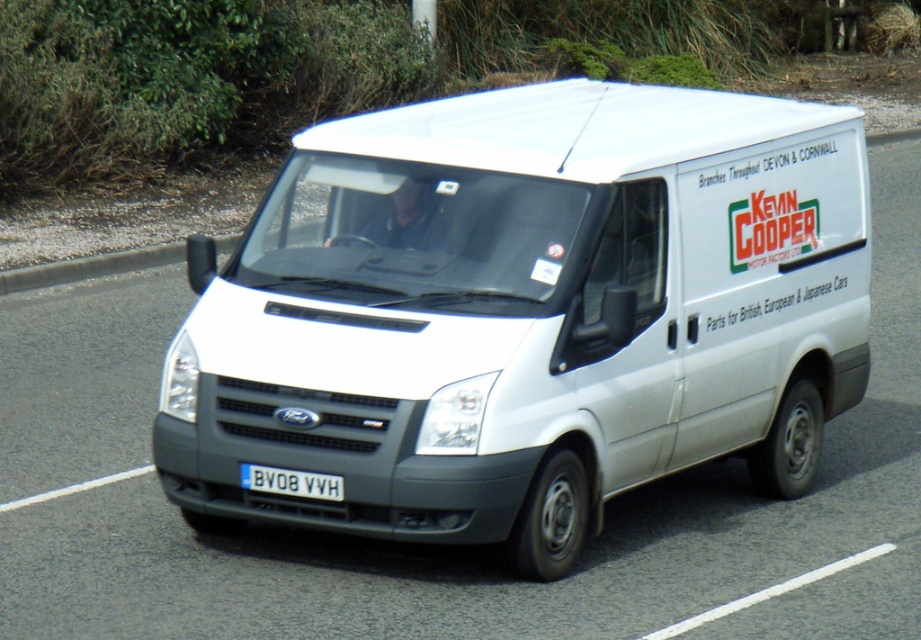
Does white matte van at center appear under white plastic license plate at center?

No.

Can you confirm if white matte van at center is positioned to the right of white plastic license plate at center?

Yes, white matte van at center is to the right of white plastic license plate at center.

Find the location of a particular element. The width and height of the screenshot is (921, 640). white matte van at center is located at coordinates (526, 314).

You are a GUI agent. You are given a task and a screenshot of the screen. Output one action in this format:
    pyautogui.click(x=<x>, y=<y>)
    Task: Click on the white matte van at center
    Image resolution: width=921 pixels, height=640 pixels.
    Given the screenshot: What is the action you would take?
    pyautogui.click(x=526, y=314)